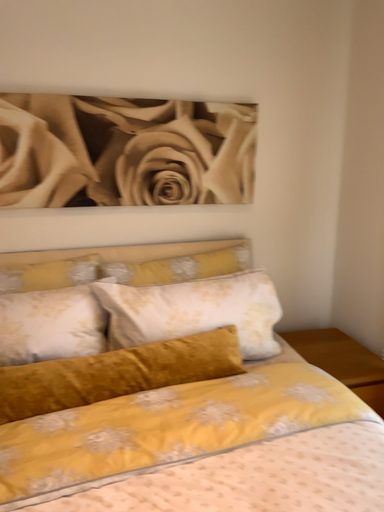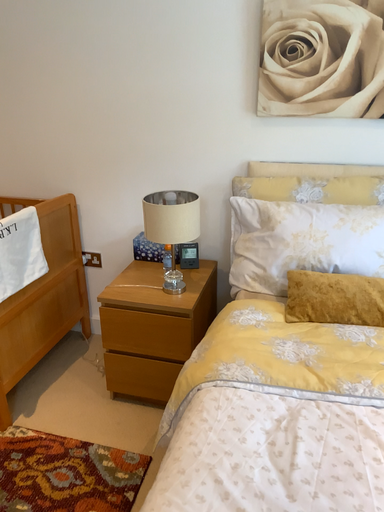
Question: How did the camera likely rotate when shooting the video?

Choices:
 (A) rotated downward
 (B) rotated upward

Answer: (A)